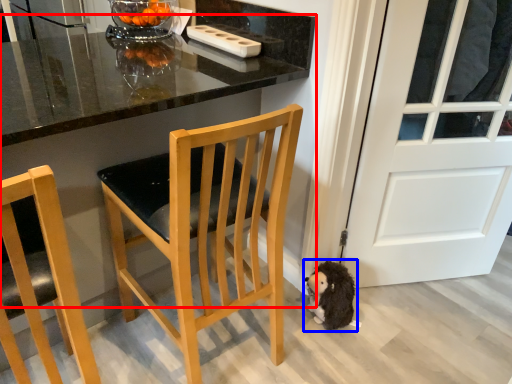
Question: Which point is further to the camera, table (highlighted by a red box) or animal (highlighted by a blue box)?

Choices:
 (A) table
 (B) animal

Answer: (B)